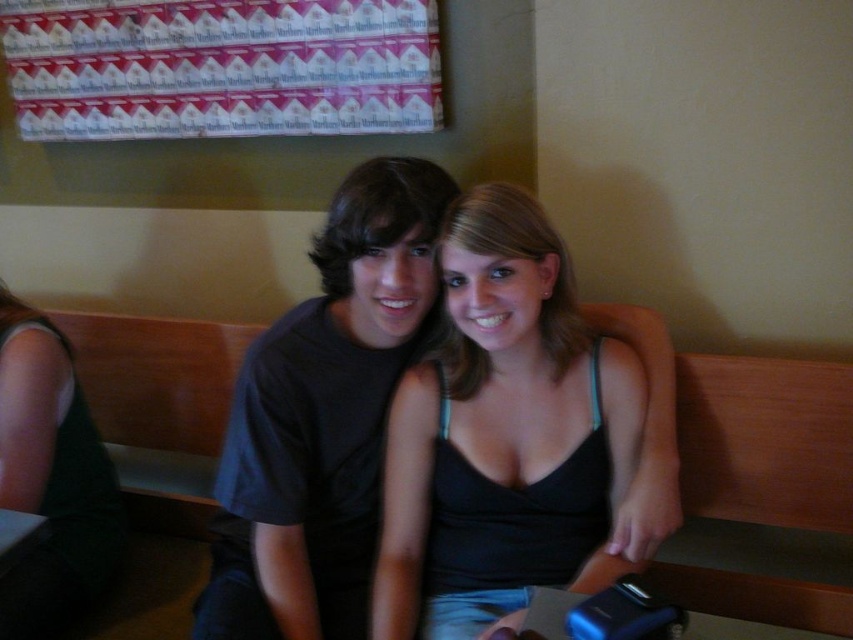
Looking at this image, does black matte tank top at center have a lesser width compared to dark gray t-shirt at center?

No, black matte tank top at center is not thinner than dark gray t-shirt at center.

Who is shorter, black matte tank top at center or dark gray t-shirt at center?

With less height is black matte tank top at center.

At what (x,y) coordinates should I click in order to perform the action: click on black matte tank top at center. Please return your answer as a coordinate pair (x, y). Image resolution: width=853 pixels, height=640 pixels. Looking at the image, I should click on (502, 426).

In order to click on black matte tank top at center in this screenshot , I will do pyautogui.click(x=502, y=426).

Does dark gray t-shirt at center appear on the left side of wooden bench at center?

Indeed, dark gray t-shirt at center is positioned on the left side of wooden bench at center.

Does dark gray t-shirt at center lie behind wooden bench at center?

No, it is in front of wooden bench at center.

At what (x,y) coordinates should I click in order to perform the action: click on dark gray t-shirt at center. Please return your answer as a coordinate pair (x, y). The width and height of the screenshot is (853, 640). Looking at the image, I should click on (323, 417).

Which is more to the right, black matte tank top at center or wooden bench at center?

wooden bench at center is more to the right.

Describe the element at coordinates (502, 426) in the screenshot. The image size is (853, 640). I see `black matte tank top at center` at that location.

Where is `black matte tank top at center`? The height and width of the screenshot is (640, 853). black matte tank top at center is located at coordinates (502, 426).